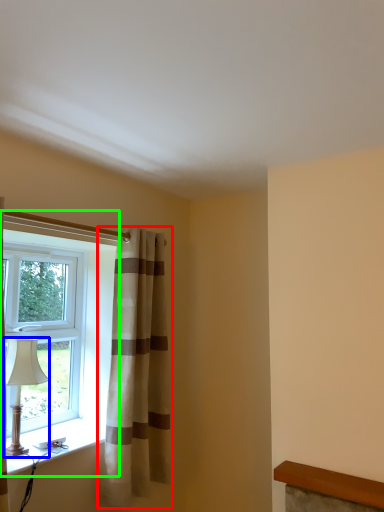
Question: Estimate the real-world distances between objects in this image. Which object is farther from curtain (highlighted by a red box), table lamp (highlighted by a blue box) or window (highlighted by a green box)?

Choices:
 (A) table lamp
 (B) window

Answer: (A)